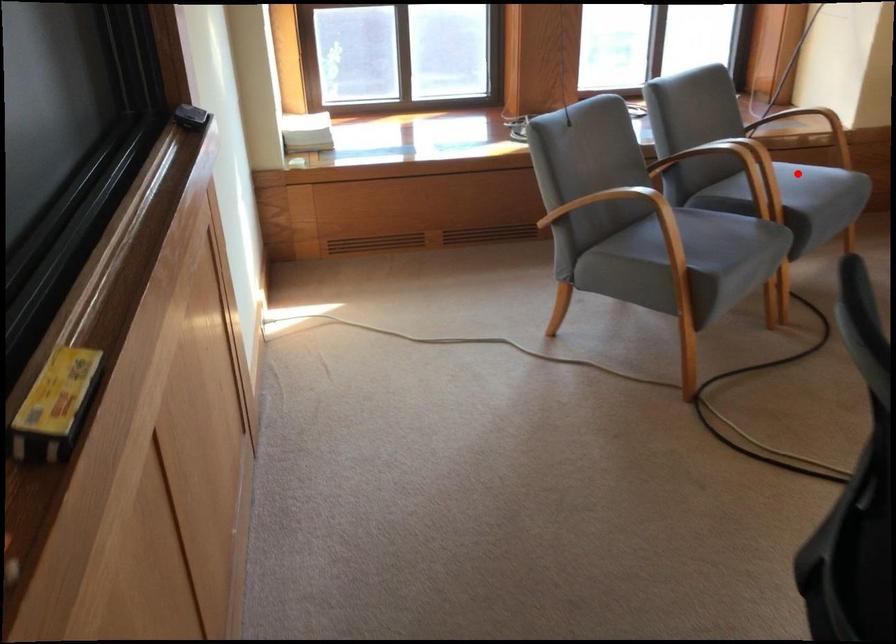
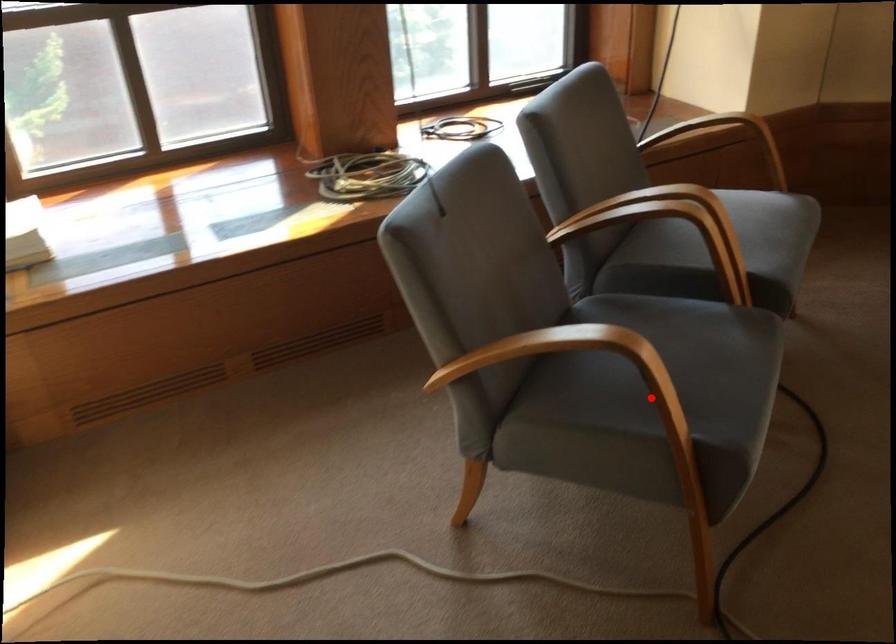
I am providing you with two images of the same scene from different viewpoints. A red point is marked on the first image and another point is marked on the second image. Do the highlighted points in image1 and image2 indicate the same real-world spot?

No